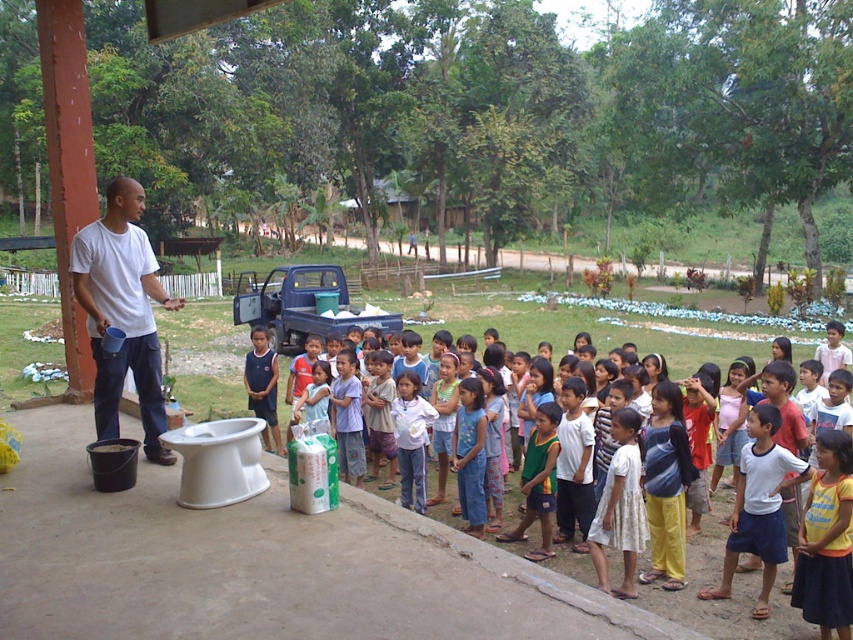
Question: Among these points, which one is nearest to the camera?

Choices:
 (A) (517, 476)
 (B) (112, 435)

Answer: (B)

Question: Which of the following is the farthest from the observer?

Choices:
 (A) light blue denim shorts at center
 (B) white matte shirt at left

Answer: (A)

Question: Is white matte shirt at left thinner than light blue denim shorts at center?

Choices:
 (A) no
 (B) yes

Answer: (A)

Question: Is white matte shirt at left below light blue denim shorts at center?

Choices:
 (A) no
 (B) yes

Answer: (A)

Question: Which point is closer to the camera taking this photo?

Choices:
 (A) 126,244
 (B) 712,552

Answer: (A)

Question: Is white matte shirt at left to the right of light blue denim shorts at center from the viewer's perspective?

Choices:
 (A) yes
 (B) no

Answer: (B)